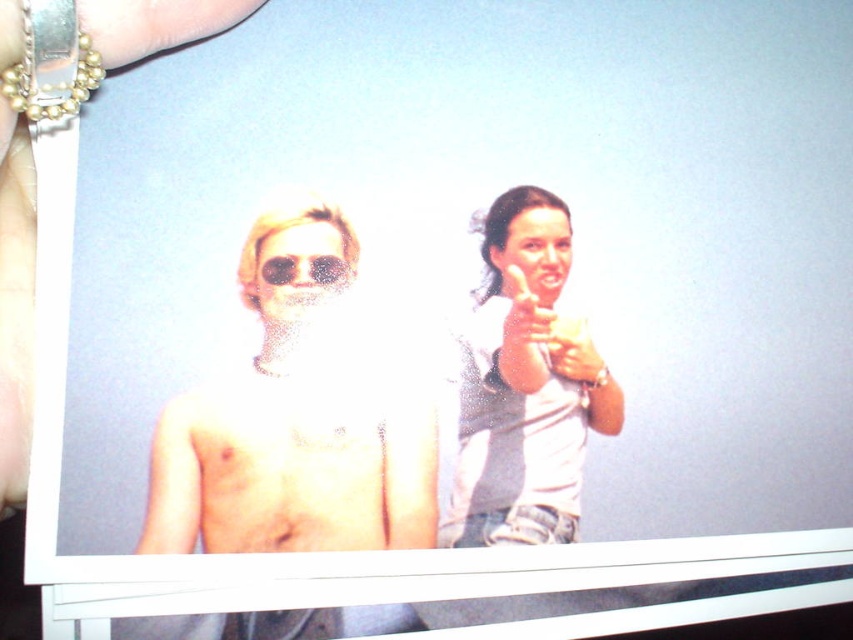
You are a photographer reviewing a photo and notice two pairs of sunglasses in the image. The shiny metallic sunglasses at left and the matte sunglasses at center. Which pair is closer to the bottom edge of the photo?

The shiny metallic sunglasses at left is positioned under the matte sunglasses at center, so it is closer to the bottom edge of the photo.

In the image, there is a point labeled at coordinates (x=294, y=426). Based on the scene description, what object does this point most likely represent?

The point at coordinates (x=294, y=426) corresponds to the shiny metallic sunglasses at left, as described in the scene.

In the photo held by the hand at the top left, there is a white matte shirt at upper right and a smooth skin face at upper right. Which object is positioned lower in the image?

The white matte shirt at upper right is located below the smooth skin face at upper right, so the white matte shirt at upper right is positioned lower in the image.